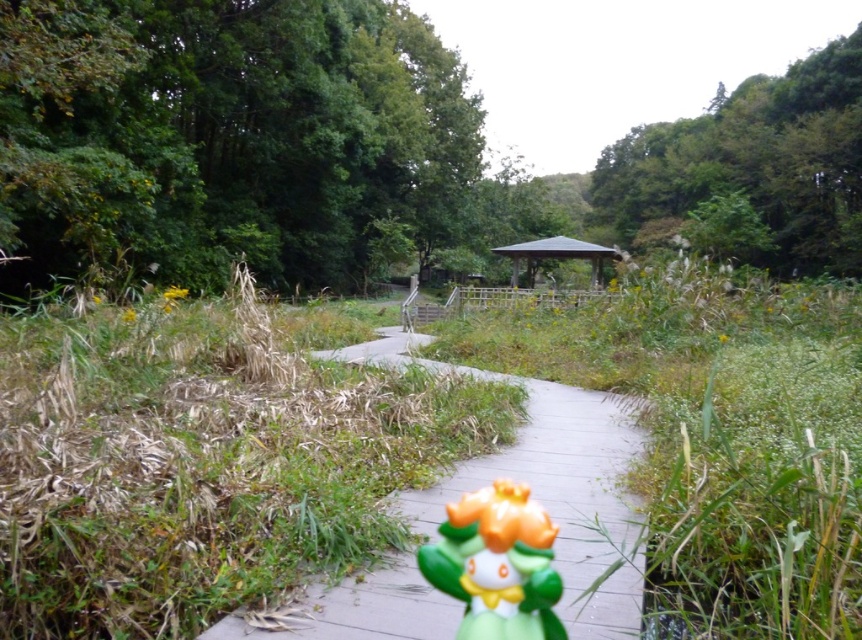
Question: Considering the real-world distances, which object is farthest from the wooden at center?

Choices:
 (A) green wooden gazebo at center
 (B) green grass at center

Answer: (A)

Question: Which of the following is the farthest from the observer?

Choices:
 (A) (448, 634)
 (B) (528, 280)
 (C) (86, 323)
 (D) (434, 557)

Answer: (B)

Question: Is wooden at center below green wooden gazebo at center?

Choices:
 (A) yes
 (B) no

Answer: (A)

Question: In this image, where is green plastic figurine at center located relative to green wooden gazebo at center?

Choices:
 (A) below
 (B) above

Answer: (A)

Question: Does green grass at center appear over green plastic figurine at center?

Choices:
 (A) no
 (B) yes

Answer: (B)

Question: Which is farther from the green wooden gazebo at center?

Choices:
 (A) wooden at center
 (B) green plastic figurine at center
 (C) green grass at center

Answer: (B)